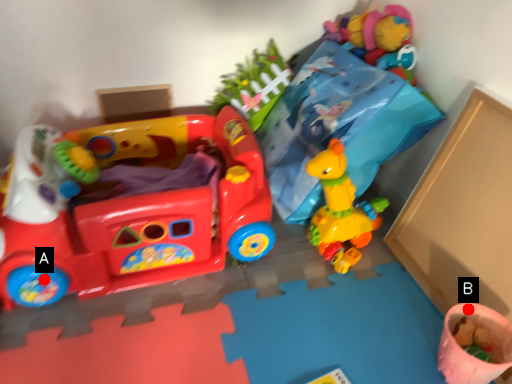
Question: Two points are circled on the image, labeled by A and B beside each circle. Which point is further to the camera?

Choices:
 (A) A is further
 (B) B is further

Answer: (A)